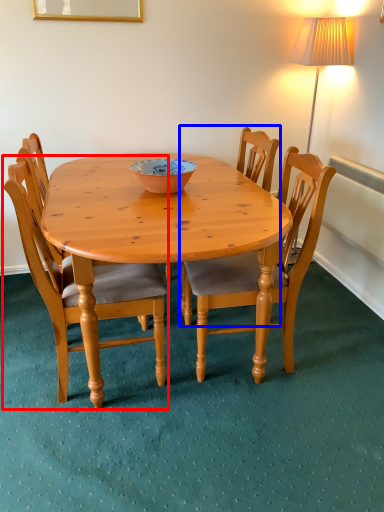
Question: Which of the following is the closest to the observer, chair (highlighted by a red box) or chair (highlighted by a blue box)?

Choices:
 (A) chair
 (B) chair

Answer: (A)